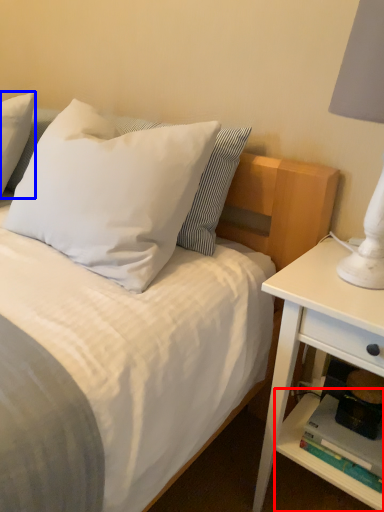
Question: Among these objects, which one is nearest to the camera, shelf (highlighted by a red box) or pillow (highlighted by a blue box)?

Choices:
 (A) shelf
 (B) pillow

Answer: (A)